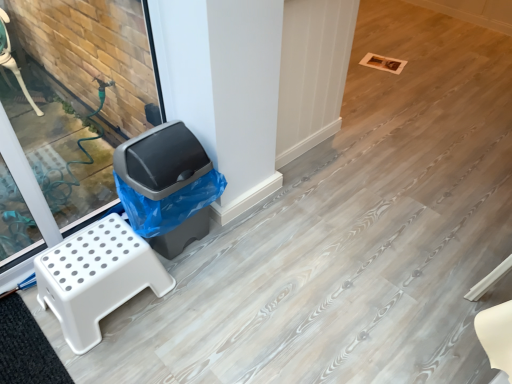
Locate an element on the screen. Image resolution: width=512 pixels, height=384 pixels. free spot to the right of white plastic step stool at left is located at coordinates (196, 304).